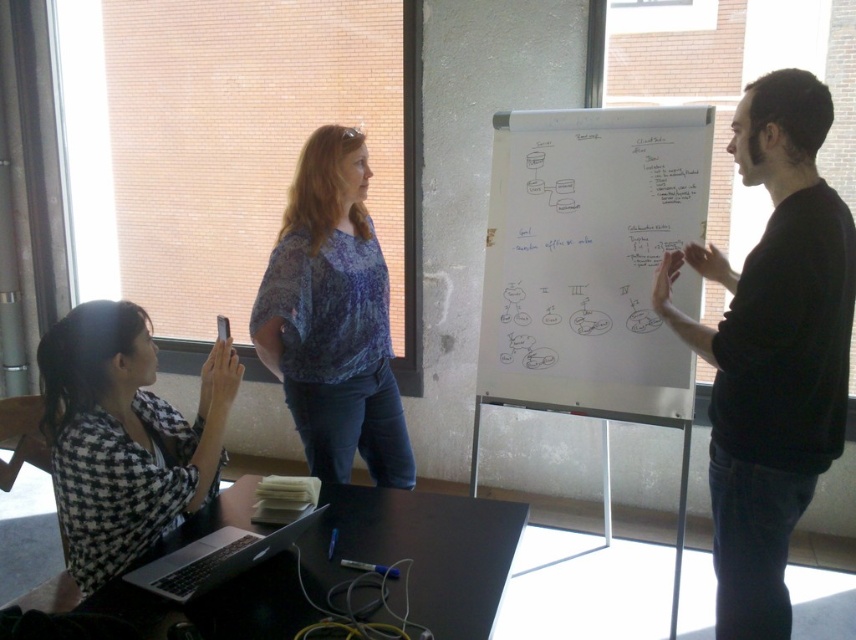
Question: Is blue printed blouse at center thinner than black checkered shirt at lower left?

Choices:
 (A) no
 (B) yes

Answer: (B)

Question: Does white paperboard at center appear on the right side of black matte shirt at right?

Choices:
 (A) no
 (B) yes

Answer: (A)

Question: Observing the image, what is the correct spatial positioning of white paperboard at center in reference to black checkered shirt at lower left?

Choices:
 (A) left
 (B) right

Answer: (B)

Question: Which object is farther from the camera taking this photo?

Choices:
 (A) black checkered shirt at lower left
 (B) black matte shirt at right
 (C) white paperboard at center
 (D) silver metallic laptop at lower left

Answer: (C)

Question: Which object is closer to the camera taking this photo?

Choices:
 (A) black checkered shirt at lower left
 (B) blue printed blouse at center
 (C) white paperboard at center
 (D) silver metallic laptop at lower left

Answer: (D)

Question: Which point is closer to the camera?

Choices:
 (A) white paperboard at center
 (B) silver metallic laptop at lower left
 (C) black matte shirt at right
 (D) blue printed blouse at center

Answer: (B)